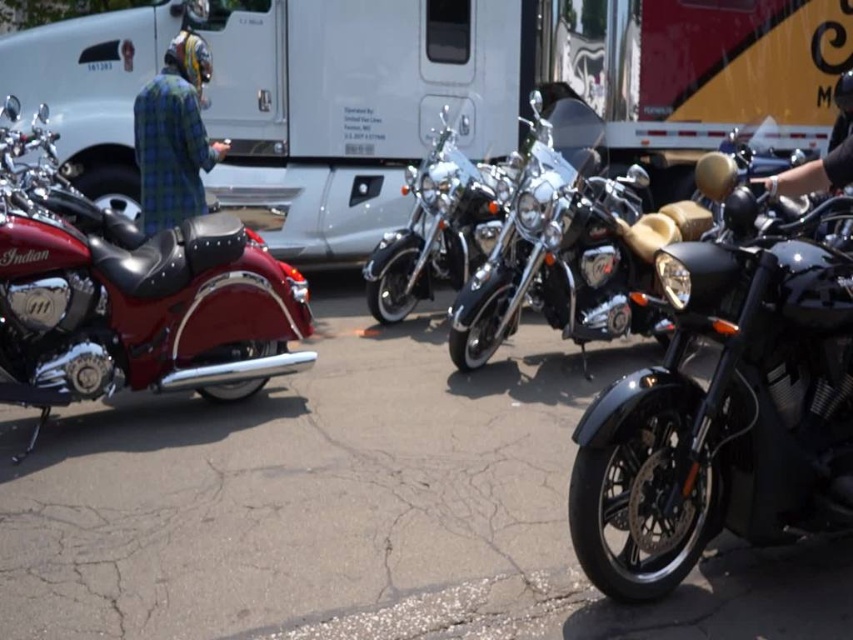
Between point (12, 305) and point (189, 90), which one is positioned in front?

Point (12, 305) is more forward.

Does shiny red leather motorcycle at left appear on the right side of plaid fabric jacket at upper left?

Yes, shiny red leather motorcycle at left is to the right of plaid fabric jacket at upper left.

Image resolution: width=853 pixels, height=640 pixels. What do you see at coordinates (136, 305) in the screenshot?
I see `shiny red leather motorcycle at left` at bounding box center [136, 305].

This screenshot has width=853, height=640. In order to click on shiny red leather motorcycle at left in this screenshot , I will do `click(136, 305)`.

Which is above, shiny red leather motorcycle at left or black leather glove at upper right?

Positioned higher is black leather glove at upper right.

Find the location of `shiny red leather motorcycle at left`. shiny red leather motorcycle at left is located at coordinates (136, 305).

Locate an element on the screen. This screenshot has height=640, width=853. shiny red leather motorcycle at left is located at coordinates (136, 305).

Can you confirm if black leather motorcycle at center is thinner than black leather glove at upper right?

Incorrect, black leather motorcycle at center's width is not less than black leather glove at upper right's.

Who is more forward, [462,301] or [838,177]?

Point [838,177] is in front.

You are a GUI agent. You are given a task and a screenshot of the screen. Output one action in this format:
    pyautogui.click(x=<x>, y=<y>)
    Task: Click on the black leather motorcycle at center
    The height and width of the screenshot is (640, 853).
    Given the screenshot: What is the action you would take?
    [x=569, y=252]